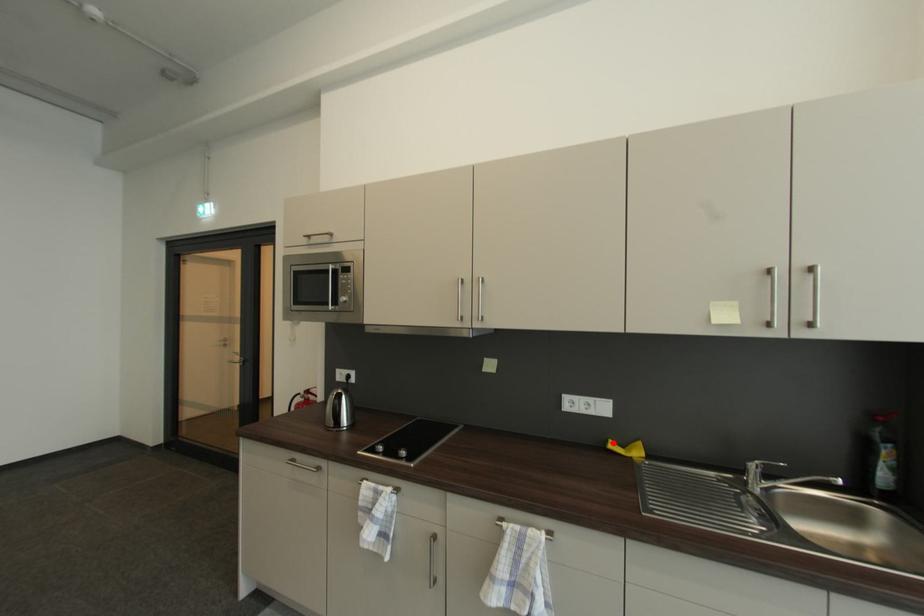
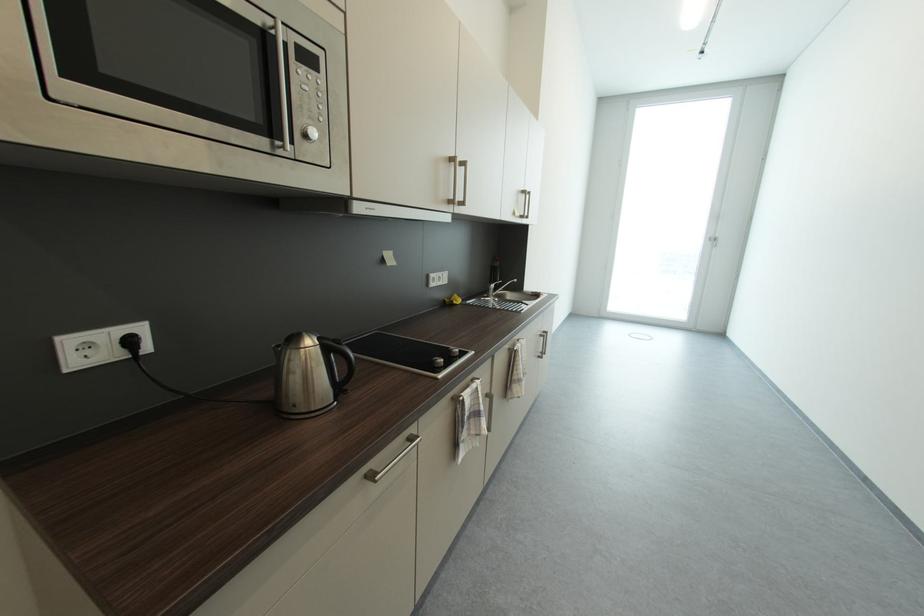
In the second image, find the point that corresponds to the highlighted location in the first image.

(453, 302)